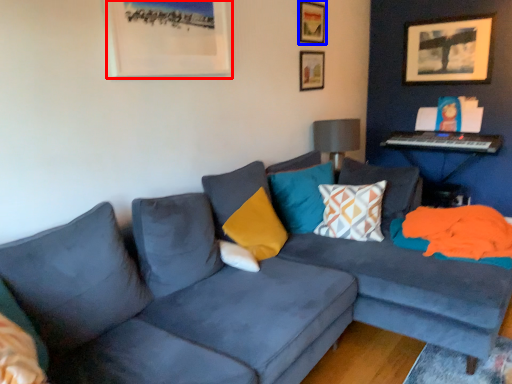
Question: Which of the following is the closest to the observer, picture frame (highlighted by a red box) or picture frame (highlighted by a blue box)?

Choices:
 (A) picture frame
 (B) picture frame

Answer: (A)